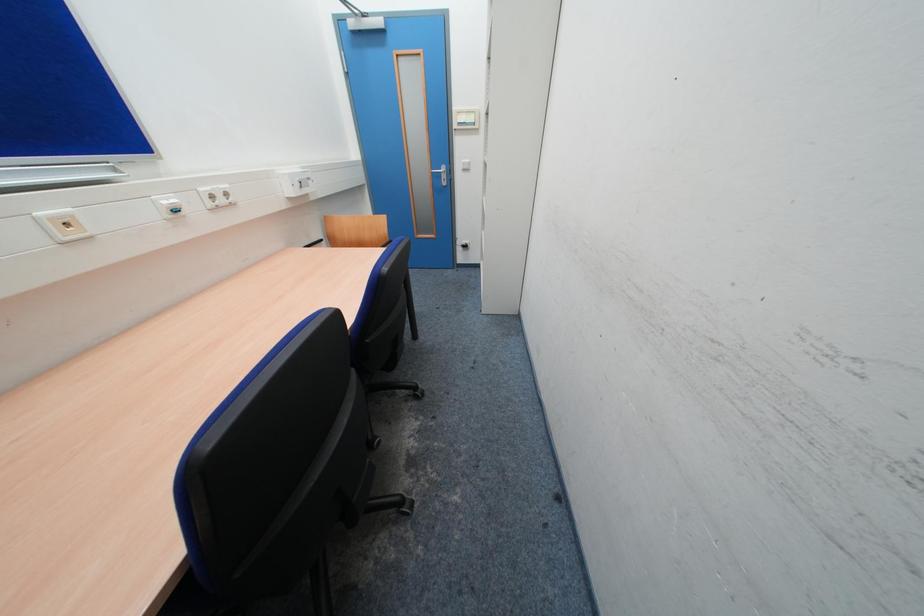
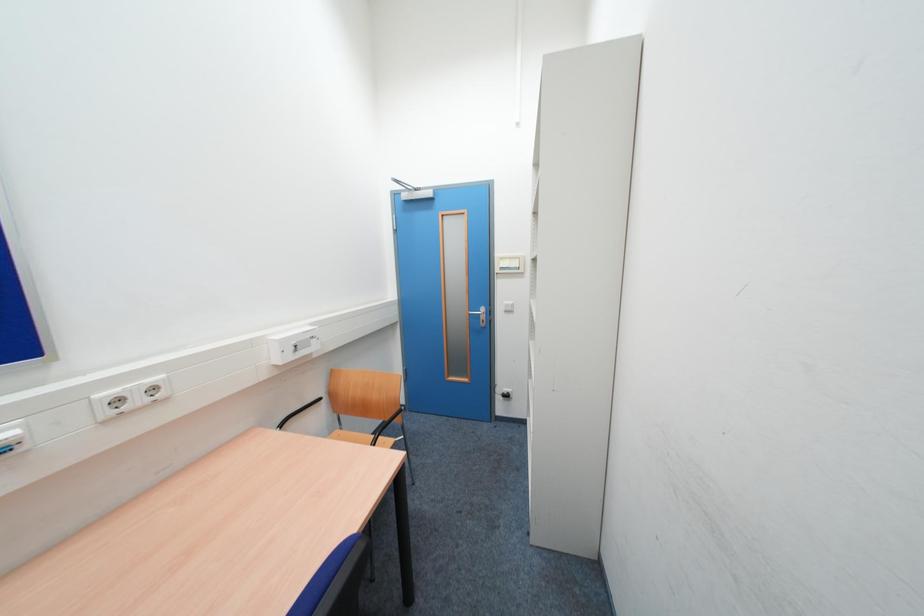
Question: The images are taken continuously from a first-person perspective. In which direction is your viewpoint rotating?

Choices:
 (A) Left
 (B) Right
 (C) Up
 (D) Down

Answer: (C)